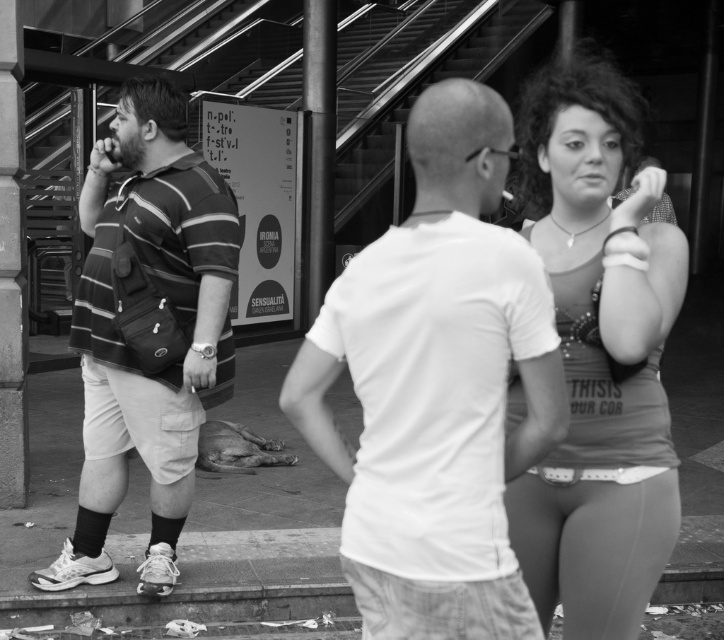
Where is `white cotton t-shirt at center`? white cotton t-shirt at center is located at coordinates (437, 387).

The image size is (724, 640). Identify the location of white cotton t-shirt at center. (437, 387).

Between matte gray tank top at right and striped fabric shirt at left, which one appears on the left side from the viewer's perspective?

From the viewer's perspective, striped fabric shirt at left appears more on the left side.

Between point (648, 435) and point (104, 496), which one is positioned in front?

Point (648, 435) is more forward.

Find the location of a particular element. This screenshot has width=724, height=640. matte gray tank top at right is located at coordinates (599, 358).

In order to click on matte gray tank top at right in this screenshot , I will do click(x=599, y=358).

Can you confirm if white cotton t-shirt at center is shorter than matte gray tank top at right?

Indeed, white cotton t-shirt at center has a lesser height compared to matte gray tank top at right.

Is white cotton t-shirt at center taller than matte gray tank top at right?

No.

Describe the element at coordinates (437, 387) in the screenshot. I see `white cotton t-shirt at center` at that location.

Where is `white cotton t-shirt at center`? The width and height of the screenshot is (724, 640). white cotton t-shirt at center is located at coordinates (437, 387).